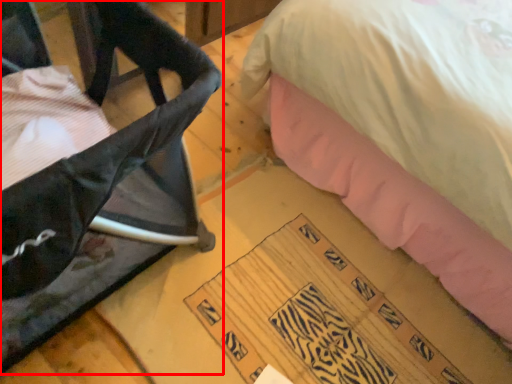
Question: From the image's perspective, where is furniture (annotated by the red box) located in relation to writing in the image?

Choices:
 (A) below
 (B) above

Answer: (B)